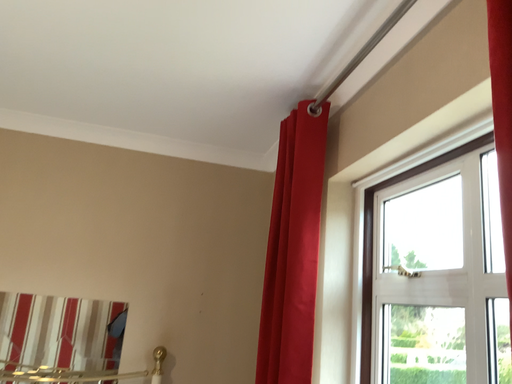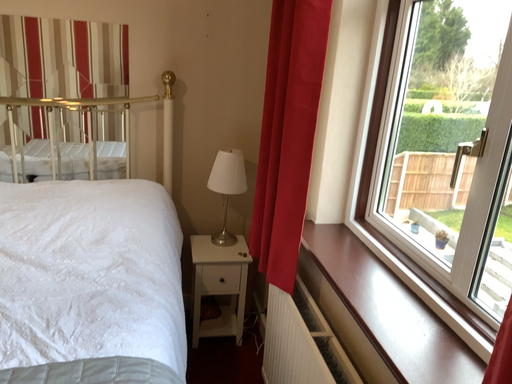
Question: Which way did the camera rotate in the video?

Choices:
 (A) rotated downward
 (B) rotated upward

Answer: (A)